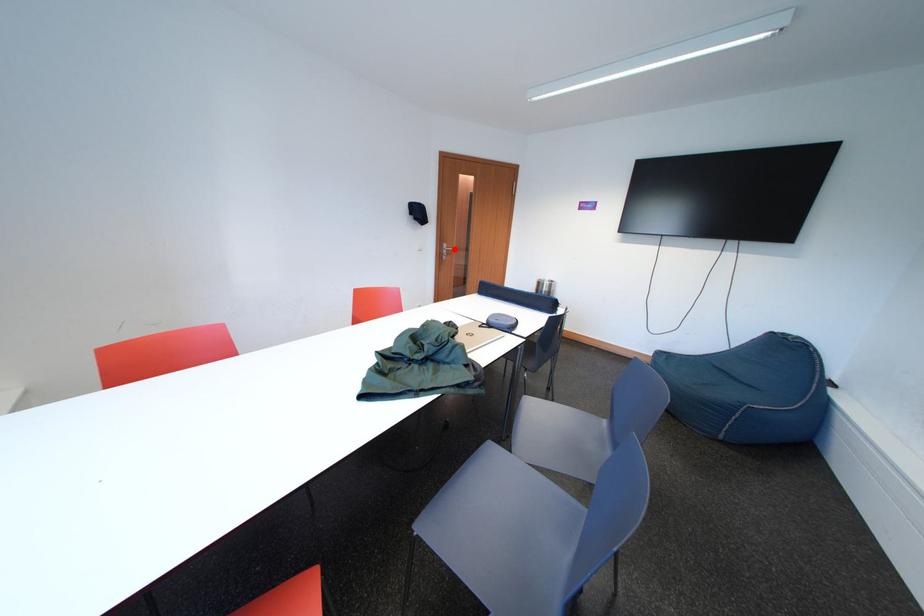
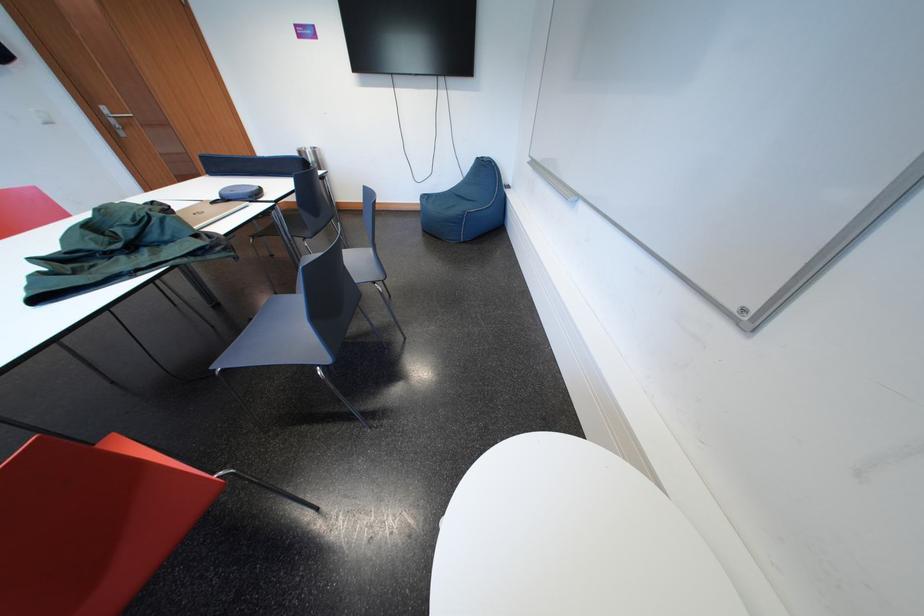
Question: I am providing you with two images of the same scene from different viewpoints. Image1 has a red point marked. In image2, the corresponding 3D location appears at what relative position? Reply with the corresponding letter.

Choices:
 (A) Closer
 (B) Farther

Answer: (B)